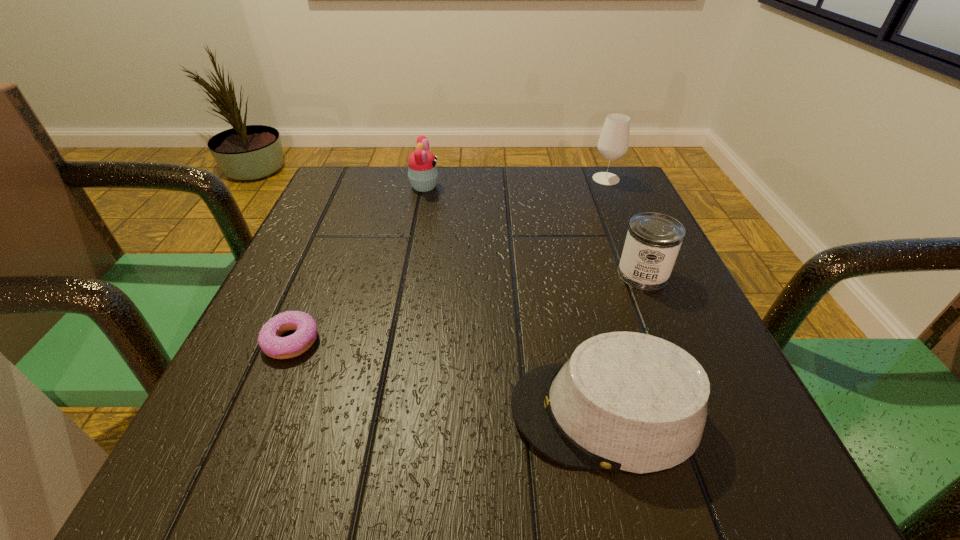
Where is `object located at the far right corner`? The height and width of the screenshot is (540, 960). object located at the far right corner is located at coordinates (613, 142).

Locate an element on the screen. This screenshot has width=960, height=540. object present at the near right corner is located at coordinates (625, 401).

What are the coordinates of `free space at the far edge of the desktop` in the screenshot? It's located at (532, 213).

The image size is (960, 540). In the image, there is a desktop. In order to click on vacant space at the near edge in this screenshot , I will do `click(512, 444)`.

In the image, there is a desktop. Where is `vacant space at the left edge`? The height and width of the screenshot is (540, 960). vacant space at the left edge is located at coordinates (336, 348).

Locate an element on the screen. The image size is (960, 540). free space at the right edge is located at coordinates (641, 330).

In the image, there is a desktop. Where is `vacant space at the far left corner`? This screenshot has height=540, width=960. vacant space at the far left corner is located at coordinates (376, 195).

The width and height of the screenshot is (960, 540). I want to click on free space between the second shortest object and the tallest object, so click(x=606, y=295).

Locate an element on the screen. Image resolution: width=960 pixels, height=540 pixels. unoccupied position between the glass and the cupcake is located at coordinates (516, 183).

Where is `free spot between the fourth object from right to left and the doughnut`? Image resolution: width=960 pixels, height=540 pixels. free spot between the fourth object from right to left and the doughnut is located at coordinates (358, 264).